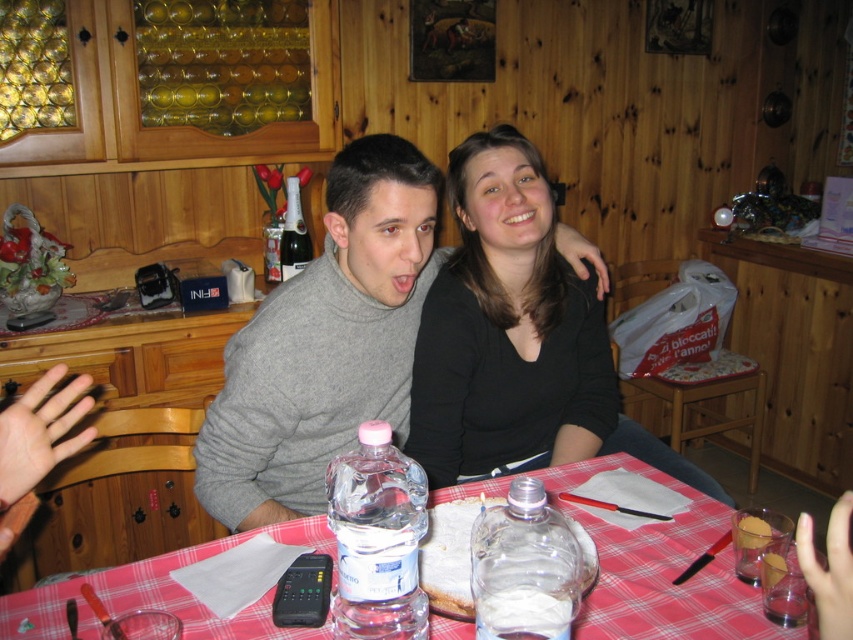
You are a waiter in a restaurant and need to place a new order of drinks on the table. The table has a checkered fabric tablecloth at center and a transparent plastic water bottle at table. Where should you place the drinks to avoid covering the water bottle?

Place the drinks on the checkered fabric tablecloth at center since it is located below the transparent plastic water bottle at table, ensuring the drinks won not cover the water bottle.

You are a waiter in a restaurant and you need to deliver a drink to the clear plastic bottle at table center. However, there is a black matte shirt at center in the way. Can you pour the drink into the bottle without moving the shirt?

The black matte shirt at center is above the clear plastic bottle at table center, so you cannot pour the drink into the bottle without moving the shirt.

You are a server in a restaurant and need to place a new order of drinks on the table. The table has a checkered fabric tablecloth at center and a transparent plastic water bottle at table. Which object should you avoid placing drinks on to prevent spills?

You should avoid placing drinks on the checkered fabric tablecloth at center because it has a larger size compared to the transparent plastic water bottle at table, making it more prone to spills if not placed carefully.